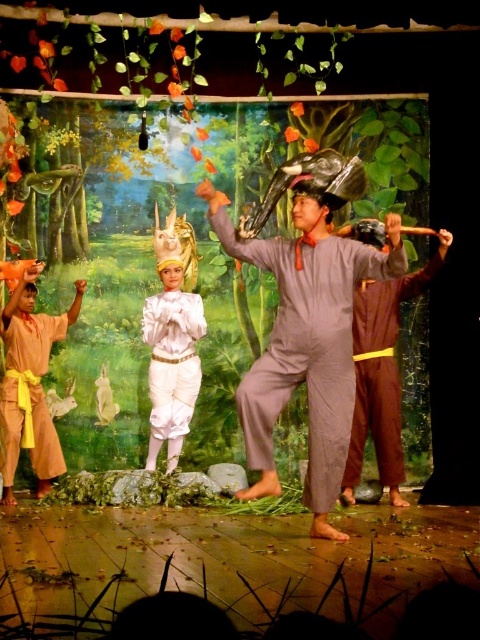
Question: Does brown cotton pants at center appear under white satin costume at center?

Choices:
 (A) yes
 (B) no

Answer: (A)

Question: Which of the following is the closest to the observer?

Choices:
 (A) (20, 408)
 (B) (380, 461)

Answer: (B)

Question: Does matte brown robe at left appear on the left side of white satin costume at center?

Choices:
 (A) yes
 (B) no

Answer: (A)

Question: Which object is closer to the camera taking this photo?

Choices:
 (A) matte brown robe at left
 (B) brown cotton pants at center

Answer: (B)

Question: Which point is closer to the camera?

Choices:
 (A) matte brown robe at left
 (B) white satin costume at center

Answer: (A)

Question: Where is matte gray jumpsuit at center located in relation to white satin costume at center in the image?

Choices:
 (A) right
 (B) left

Answer: (A)